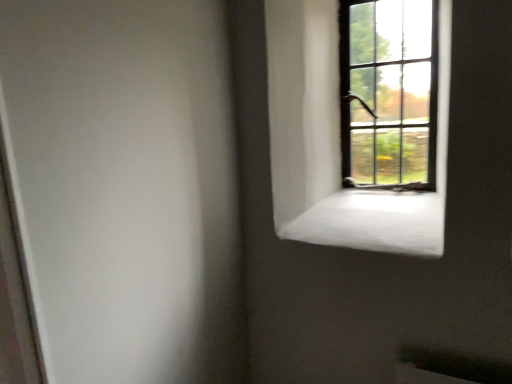
What do you see at coordinates (389, 93) in the screenshot? I see `dark brown wooden window at upper right` at bounding box center [389, 93].

Find the location of a particular element. dark brown wooden window at upper right is located at coordinates (389, 93).

Describe the element at coordinates (374, 222) in the screenshot. I see `white concrete window sill at upper right` at that location.

Locate an element on the screen. The width and height of the screenshot is (512, 384). white concrete window sill at upper right is located at coordinates (374, 222).

Where is `dark brown wooden window at upper right`? This screenshot has width=512, height=384. dark brown wooden window at upper right is located at coordinates (389, 93).

In the scene shown: Between dark brown wooden window at upper right and white concrete window sill at upper right, which one appears on the left side from the viewer's perspective?

Positioned to the left is white concrete window sill at upper right.

Considering their positions, is dark brown wooden window at upper right located in front of or behind white concrete window sill at upper right?

dark brown wooden window at upper right is behind white concrete window sill at upper right.

Is point (426, 37) less distant than point (310, 214)?

No, it is behind (310, 214).

From the image's perspective, would you say dark brown wooden window at upper right is positioned over white concrete window sill at upper right?

Yes, from the image's perspective, dark brown wooden window at upper right is on top of white concrete window sill at upper right.

From a real-world perspective, is dark brown wooden window at upper right over white concrete window sill at upper right?

Yes.

Can you confirm if dark brown wooden window at upper right is wider than white concrete window sill at upper right?

No.

In terms of height, does dark brown wooden window at upper right look taller or shorter compared to white concrete window sill at upper right?

Considering their sizes, dark brown wooden window at upper right has more height than white concrete window sill at upper right.

Between dark brown wooden window at upper right and white concrete window sill at upper right, which one has smaller size?

dark brown wooden window at upper right.

Can we say dark brown wooden window at upper right lies outside white concrete window sill at upper right?

That's correct, dark brown wooden window at upper right is outside of white concrete window sill at upper right.

Is dark brown wooden window at upper right with white concrete window sill at upper right?

There is a gap between dark brown wooden window at upper right and white concrete window sill at upper right.

Is white concrete window sill at upper right at the back of dark brown wooden window at upper right?

No, dark brown wooden window at upper right is not facing away from white concrete window sill at upper right.

What's the angular difference between dark brown wooden window at upper right and white concrete window sill at upper right's facing directions?

The facing directions of dark brown wooden window at upper right and white concrete window sill at upper right are 0.00387 degrees apart.

How far apart are dark brown wooden window at upper right and white concrete window sill at upper right?

The distance of dark brown wooden window at upper right from white concrete window sill at upper right is 12.67 inches.

This screenshot has width=512, height=384. In the image, there is a dark brown wooden window at upper right. In order to click on window sill below it (from the image's perspective) in this screenshot , I will do `click(374, 222)`.

Does white concrete window sill at upper right appear on the right side of dark brown wooden window at upper right?

No, white concrete window sill at upper right is not to the right of dark brown wooden window at upper right.

Considering the positions of objects white concrete window sill at upper right and dark brown wooden window at upper right in the image provided, who is behind, white concrete window sill at upper right or dark brown wooden window at upper right?

dark brown wooden window at upper right.

Which is more distant, (415, 236) or (347, 32)?

The point (347, 32) is farther from the camera.

From the image's perspective, is white concrete window sill at upper right on dark brown wooden window at upper right?

Actually, white concrete window sill at upper right appears below dark brown wooden window at upper right in the image.

From a real-world perspective, which is physically below, white concrete window sill at upper right or dark brown wooden window at upper right?

white concrete window sill at upper right is physically lower.

In terms of width, does white concrete window sill at upper right look wider or thinner when compared to dark brown wooden window at upper right?

Clearly, white concrete window sill at upper right has more width compared to dark brown wooden window at upper right.

Considering the relative sizes of white concrete window sill at upper right and dark brown wooden window at upper right in the image provided, is white concrete window sill at upper right shorter than dark brown wooden window at upper right?

Yes.

Considering the sizes of objects white concrete window sill at upper right and dark brown wooden window at upper right in the image provided, who is bigger, white concrete window sill at upper right or dark brown wooden window at upper right?

white concrete window sill at upper right.

Do you think white concrete window sill at upper right is within dark brown wooden window at upper right, or outside of it?

white concrete window sill at upper right exists outside the volume of dark brown wooden window at upper right.

Is white concrete window sill at upper right not close to dark brown wooden window at upper right?

No, white concrete window sill at upper right is not far from dark brown wooden window at upper right.

Is white concrete window sill at upper right aimed at dark brown wooden window at upper right?

No, white concrete window sill at upper right is not aimed at dark brown wooden window at upper right.

From the picture: How many degrees apart are the facing directions of white concrete window sill at upper right and dark brown wooden window at upper right?

The facing directions of white concrete window sill at upper right and dark brown wooden window at upper right are 0.00387 degrees apart.

You are a GUI agent. You are given a task and a screenshot of the screen. Output one action in this format:
    pyautogui.click(x=<x>, y=<y>)
    Task: Click on the window on the right side of white concrete window sill at upper right
    Image resolution: width=512 pixels, height=384 pixels.
    Given the screenshot: What is the action you would take?
    pyautogui.click(x=389, y=93)

Locate an element on the screen. The height and width of the screenshot is (384, 512). window sill that appears on the left of dark brown wooden window at upper right is located at coordinates (374, 222).

Where is `window sill that is under the dark brown wooden window at upper right (from a real-world perspective)`? The width and height of the screenshot is (512, 384). window sill that is under the dark brown wooden window at upper right (from a real-world perspective) is located at coordinates (374, 222).